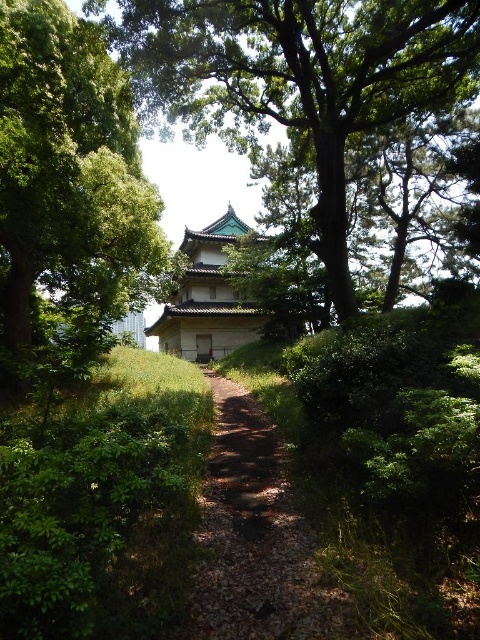
Is green textured tree at center shorter than dirt path at center?

No, green textured tree at center is not shorter than dirt path at center.

Which of these two, green textured tree at center or dirt path at center, stands shorter?

dirt path at center

Which is behind, point (456, 24) or point (256, 467)?

The point (456, 24) is more distant.

The height and width of the screenshot is (640, 480). Find the location of `green textured tree at center`. green textured tree at center is located at coordinates (x=300, y=76).

Can you confirm if green textured tree at center is positioned above green stone pagoda at center?

Correct, green textured tree at center is located above green stone pagoda at center.

Consider the image. Is the position of green textured tree at center more distant than that of green stone pagoda at center?

That is False.

Is point (236, 17) closer to camera compared to point (170, 330)?

That is True.

The width and height of the screenshot is (480, 640). Identify the location of green textured tree at center. (300, 76).

Can you confirm if dirt path at center is smaller than green stone pagoda at center?

Yes.

Between point (260, 547) and point (197, 282), which one is positioned behind?

Point (197, 282)

This screenshot has height=640, width=480. I want to click on dirt path at center, so click(256, 538).